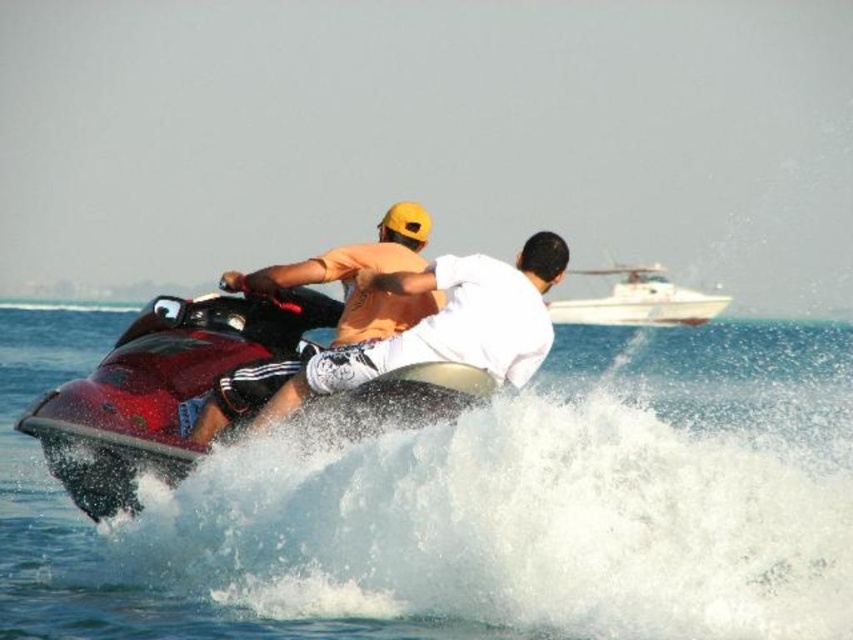
You are navigating a drone to capture aerial footage of the scene. The drone is currently at point A, which is at coordinates 0.7, 0.5. You need to adjust its position to focus on the clear water at jet ski center. Should you move the drone north or south? Please provide your answer based on the coordinates provided.

The clear water at jet ski center is located at coordinates (473, 504). Since the drone is at (426, 448), it needs to move north to increase its y coordinate from 0.5 to 0.555. Therefore, move the drone north.

You are a safety officer on a rescue boat and need to reach the shiny red jet ski at center and the white glossy boat at upper center. The rescue boat can travel 100 meters per minute. Which vessel should you prioritize reaching first if you want to arrive at both within the shortest possible time?

You should prioritize reaching the shiny red jet ski at center first because it is closer to the rescue boat than the white glossy boat at upper center. Since the distance between them is 105.79 meters, the rescue boat can reach the jet ski in about 1.06 minutes and then proceed to the boat, ensuring the shortest total travel time.

You are a photographer on a boat trying to capture the jet ski riders. You notice the clear water at jet ski center and the white glossy boat at upper center in your viewfinder. Which object should you focus on first if you want to take a sharp photo of the closest subject?

The clear water at jet ski center is in front of the white glossy boat at upper center, so you should focus on the clear water at jet ski center first as it is closer to you.